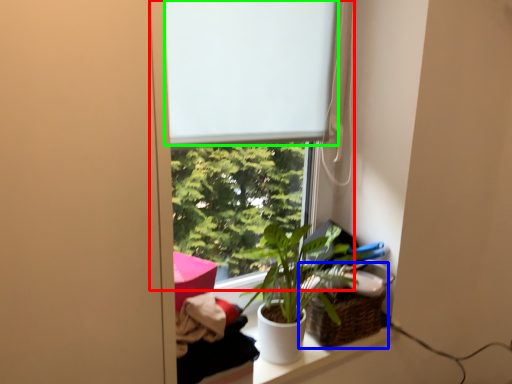
Question: Considering the real-world distances, which object is farthest from window (highlighted by a red box)? basket (highlighted by a blue box) or window screen (highlighted by a green box)?

Choices:
 (A) basket
 (B) window screen

Answer: (A)